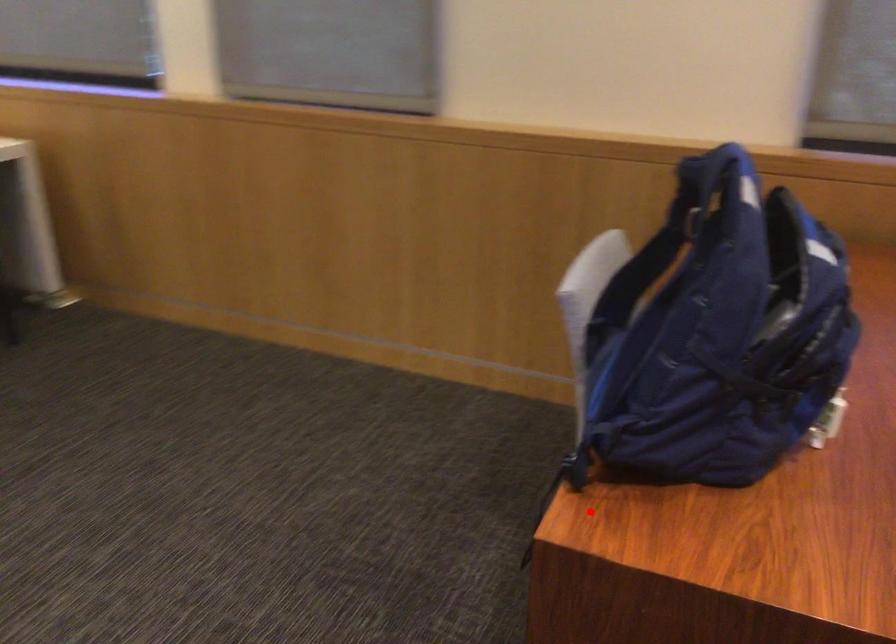
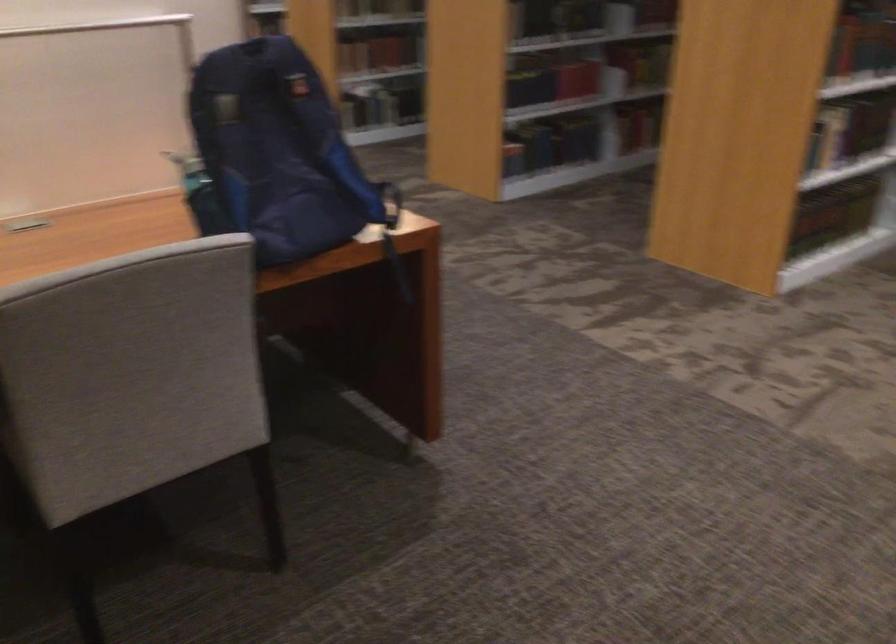
Where in the second image is the point corresponding to the highlighted location from the first image?

(392, 234)